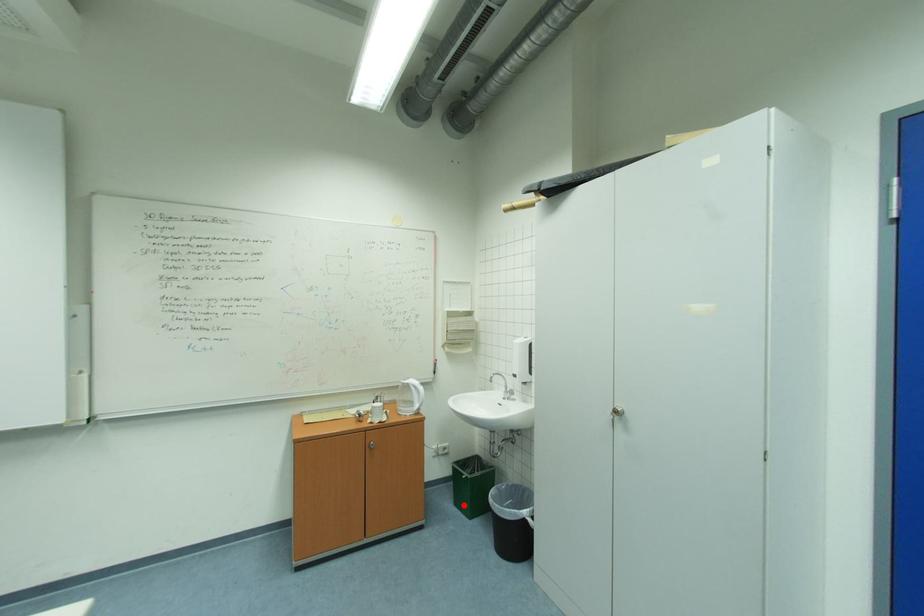
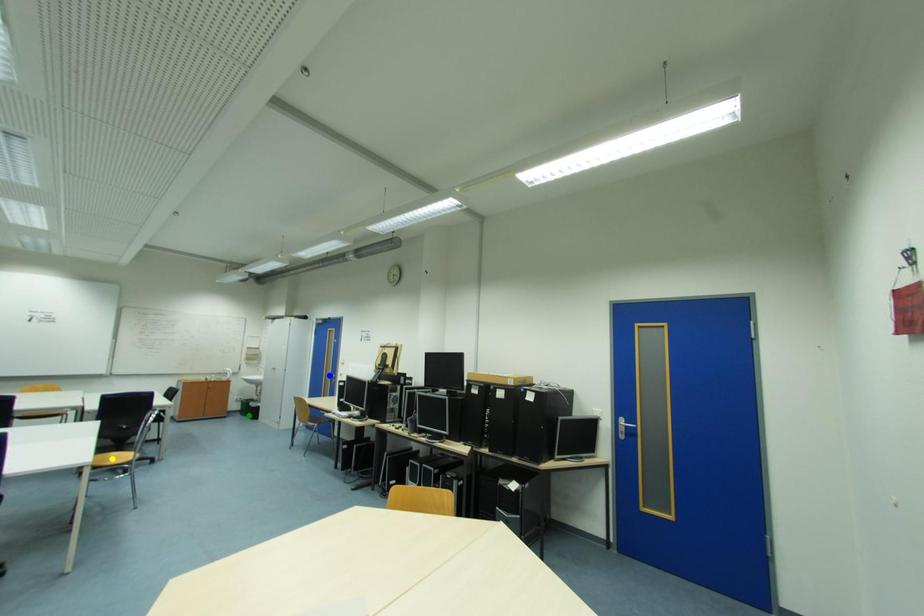
Question: I am providing you with two images of the same scene from different viewpoints. A red point is marked on the first image. You are given multiple points on the second image. Can you choose the point in image 2 that corresponds to the point in image 1?

Choices:
 (A) blue point
 (B) yellow point
 (C) green point

Answer: (C)